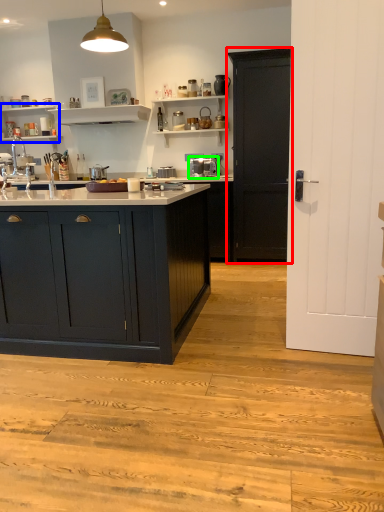
Question: Which object is positioned closest to cabinetry (highlighted by a red box)? Select from shelf (highlighted by a blue box) and coffee machine (highlighted by a green box).

Choices:
 (A) shelf
 (B) coffee machine

Answer: (B)